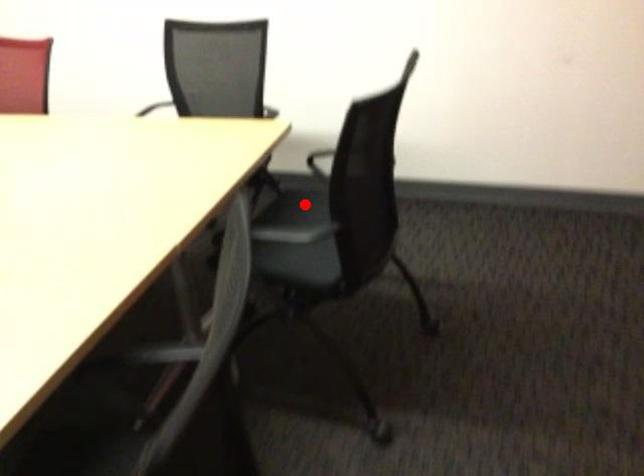
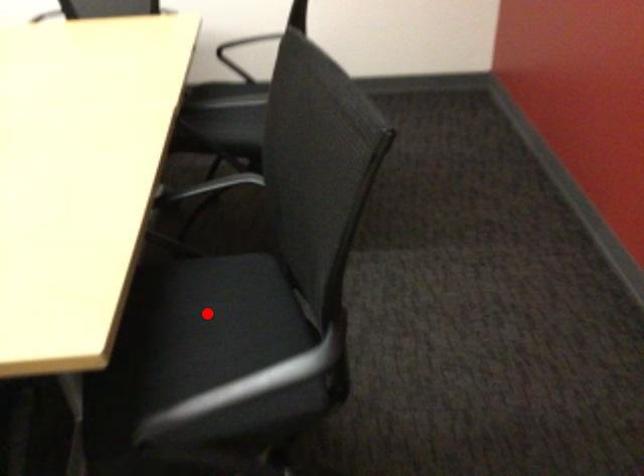
I am providing you with two images of the same scene from different viewpoints. A red point is marked on the first image and another point is marked on the second image. Does the point marked in image1 correspond to the same location as the one in image2?

No